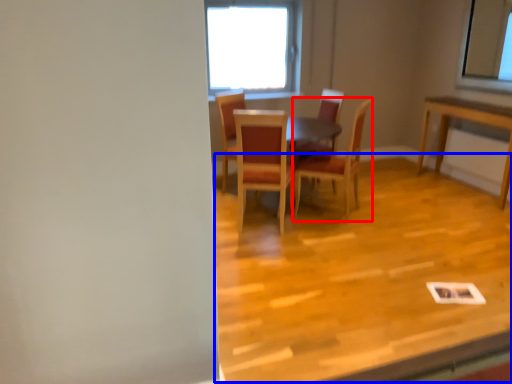
Question: Among these objects, which one is nearest to the camera, chair (highlighted by a red box) or plywood (highlighted by a blue box)?

Choices:
 (A) chair
 (B) plywood

Answer: (B)